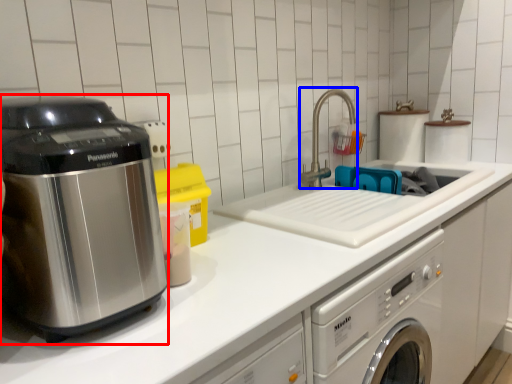
Question: Among these objects, which one is nearest to the camera, home appliance (highlighted by a red box) or faucet (highlighted by a blue box)?

Choices:
 (A) home appliance
 (B) faucet

Answer: (A)